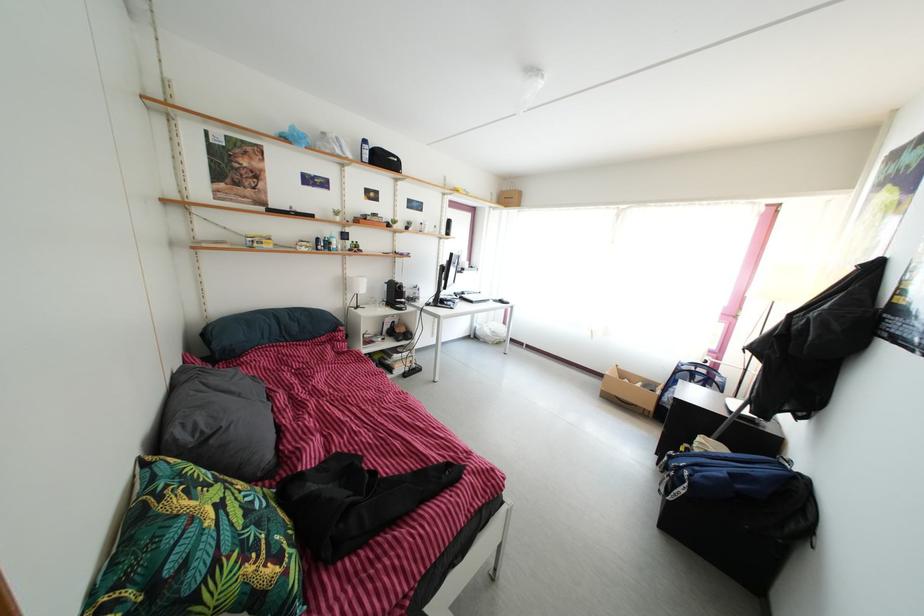
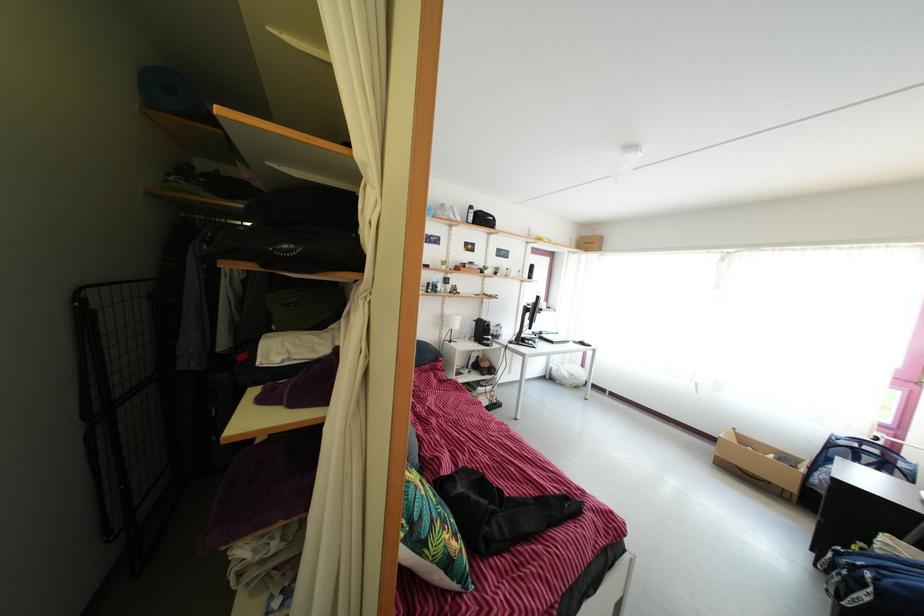
Where in the second image is the point corresponding to pixel 663 392 from the first image?

(805, 468)